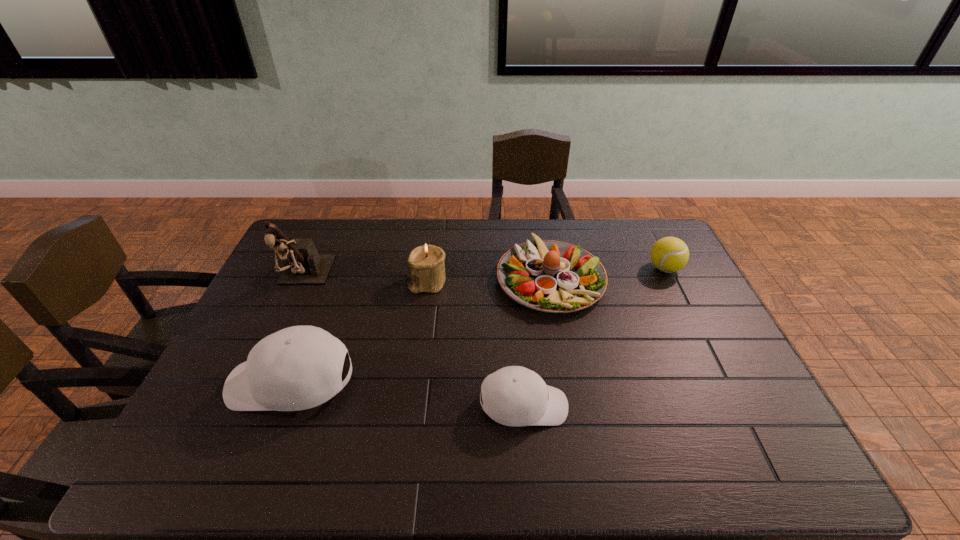
Where is `free space located on the back of the tennis ball`? free space located on the back of the tennis ball is located at coordinates (641, 220).

At what (x,y) coordinates should I click in order to perform the action: click on salad plate that is positioned at the far edge. Please return your answer as a coordinate pair (x, y). The width and height of the screenshot is (960, 540). Looking at the image, I should click on (551, 276).

Find the location of a particular element. figurine that is at the far edge is located at coordinates (303, 265).

Where is `tennis ball that is at the far edge`? This screenshot has height=540, width=960. tennis ball that is at the far edge is located at coordinates pyautogui.click(x=669, y=254).

Where is `baseball cap present at the left edge`? The image size is (960, 540). baseball cap present at the left edge is located at coordinates (300, 367).

Locate an element on the screen. This screenshot has width=960, height=540. figurine that is positioned at the left edge is located at coordinates (303, 265).

Find the location of a particular element. The width and height of the screenshot is (960, 540). object at the right edge is located at coordinates (669, 254).

Locate an element on the screen. object located at the far left corner is located at coordinates (303, 265).

The image size is (960, 540). In order to click on object situated at the near left corner in this screenshot , I will do `click(300, 367)`.

This screenshot has width=960, height=540. What are the coordinates of `object that is at the far right corner` in the screenshot? It's located at (669, 254).